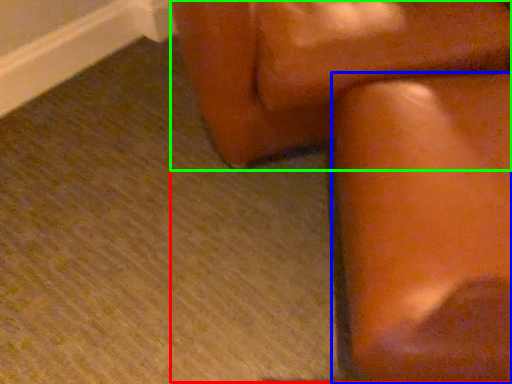
Question: Which is nearer to the rocking chair (highlighted by a red box)? furniture (highlighted by a blue box) or furniture (highlighted by a green box).

Choices:
 (A) furniture
 (B) furniture

Answer: (A)